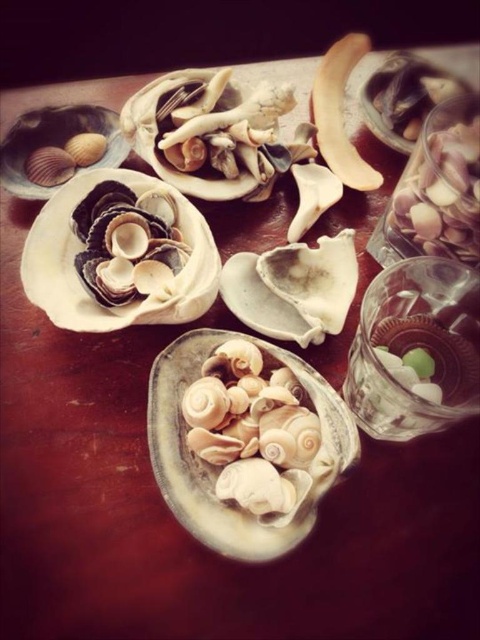
Does matte white seashells at center appear on the left side of matte white seashell at upper right?

Indeed, matte white seashells at center is positioned on the left side of matte white seashell at upper right.

How distant is matte white seashells at center from matte white seashell at upper right?

They are 27.00 centimeters apart.

What do you see at coordinates (216, 468) in the screenshot?
I see `matte white seashells at center` at bounding box center [216, 468].

This screenshot has width=480, height=640. What are the coordinates of `matte white seashells at center` in the screenshot? It's located at (216, 468).

Between matte white seashell at upper right and matte white shell at upper left, which one has less height?

matte white shell at upper left is shorter.

Is point (384, 68) behind point (13, 147)?

Yes, it is.

The image size is (480, 640). I want to click on matte white seashell at upper right, so click(406, 97).

Can you confirm if matte white seashells at center is shorter than matte white shell at upper left?

No, matte white seashells at center is not shorter than matte white shell at upper left.

Looking at this image, is matte white seashells at center above matte white shell at upper left?

Incorrect, matte white seashells at center is not positioned above matte white shell at upper left.

This screenshot has height=640, width=480. In order to click on matte white seashells at center in this screenshot , I will do `click(216, 468)`.